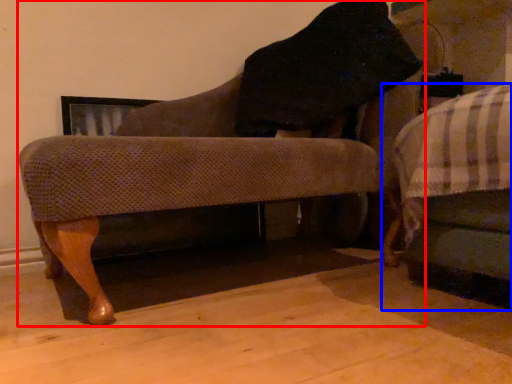
Question: Which object is further to the camera taking this photo, chair (highlighted by a red box) or furniture (highlighted by a blue box)?

Choices:
 (A) chair
 (B) furniture

Answer: (B)